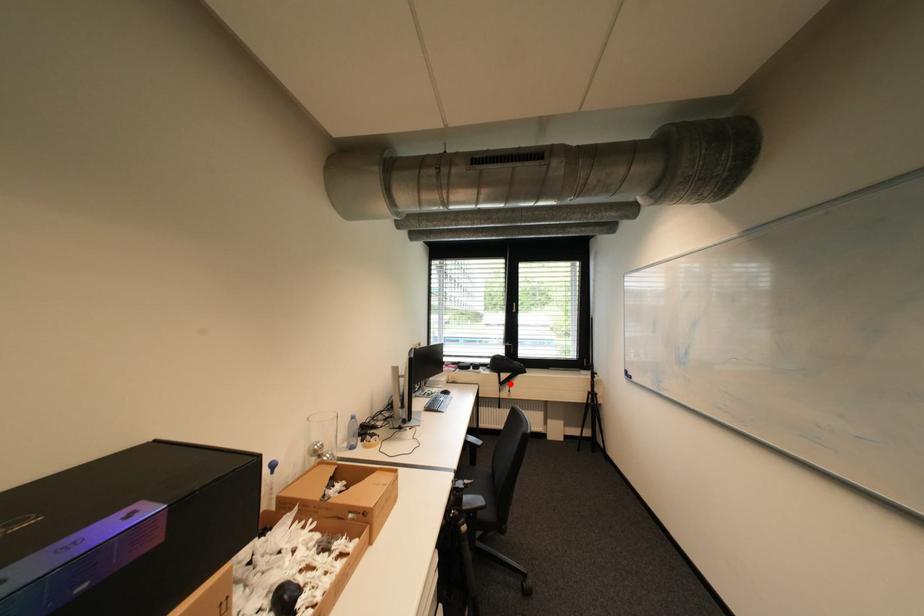
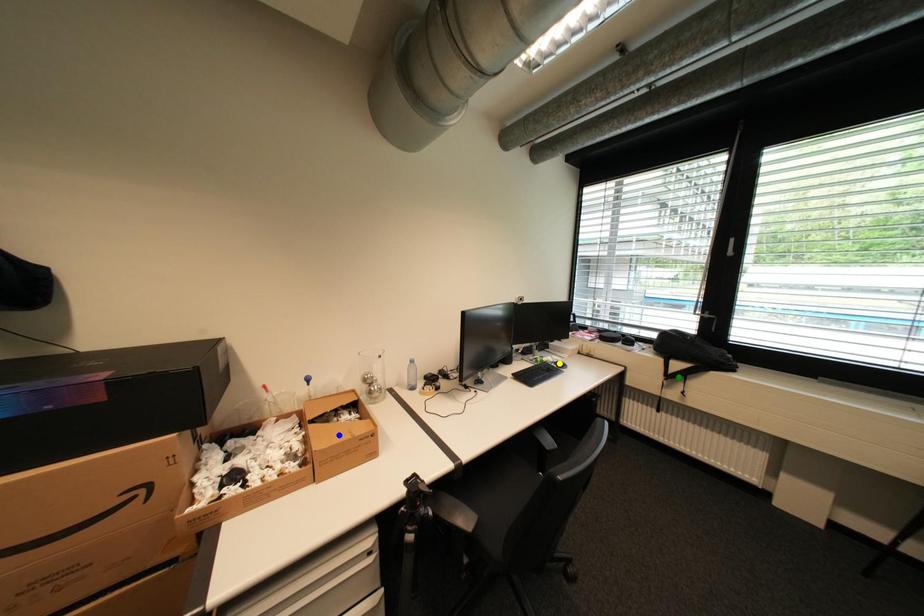
Question: I am providing you with two images of the same scene from different viewpoints. A red point is marked on the first image. You are given multiple points on the second image. Which point in image 2 is actually the same real-world point as the red point in image 1?

Choices:
 (A) green point
 (B) blue point
 (C) yellow point

Answer: (A)